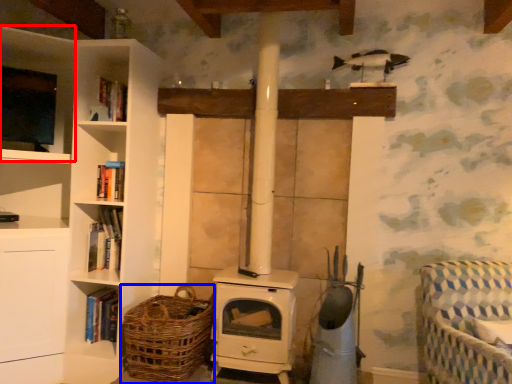
Question: Which object appears closest to the camera in this image, shelf (highlighted by a red box) or basket (highlighted by a blue box)?

Choices:
 (A) shelf
 (B) basket

Answer: (B)